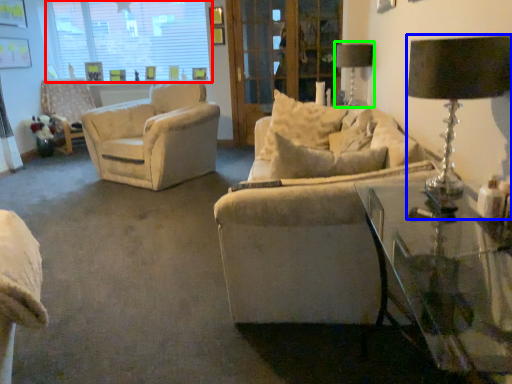
Question: Which object is positioned closest to window (highlighted by a red box)? Select from table lamp (highlighted by a blue box) and table lamp (highlighted by a green box).

Choices:
 (A) table lamp
 (B) table lamp

Answer: (B)